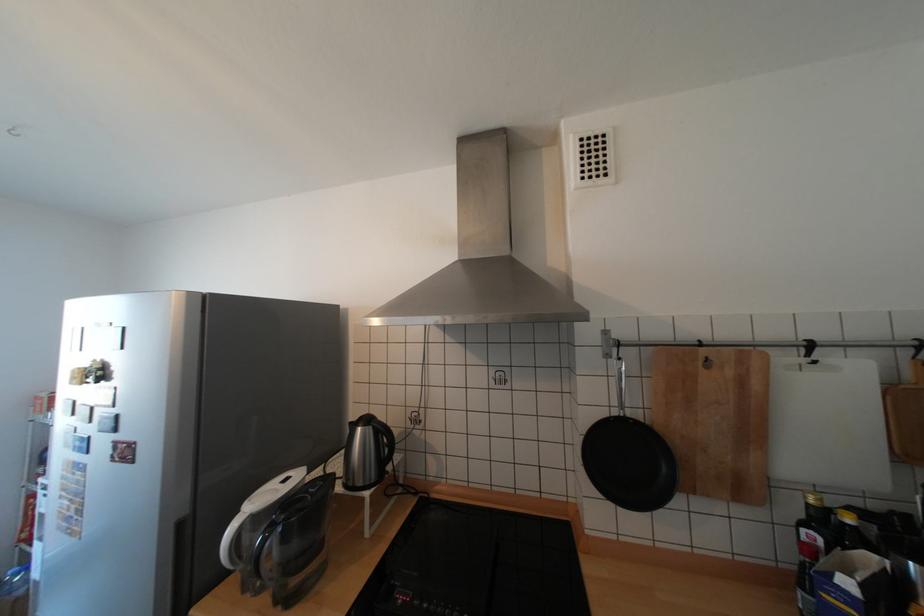
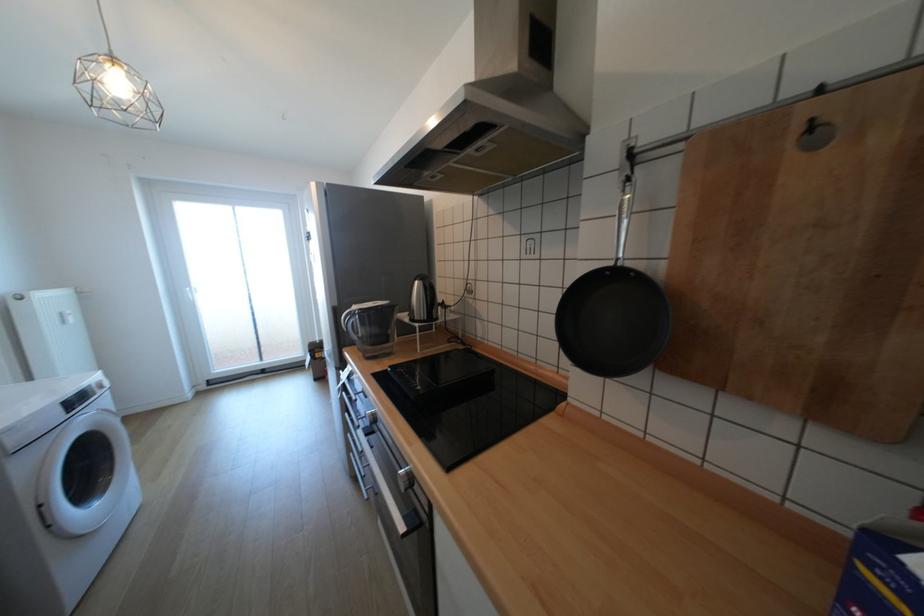
Question: The camera is either moving clockwise (left) or counter-clockwise (right) around the object. The first image is from the beginning of the video and the second image is from the end. Is the camera moving left or right when shooting the video?

Choices:
 (A) Left
 (B) Right

Answer: (B)